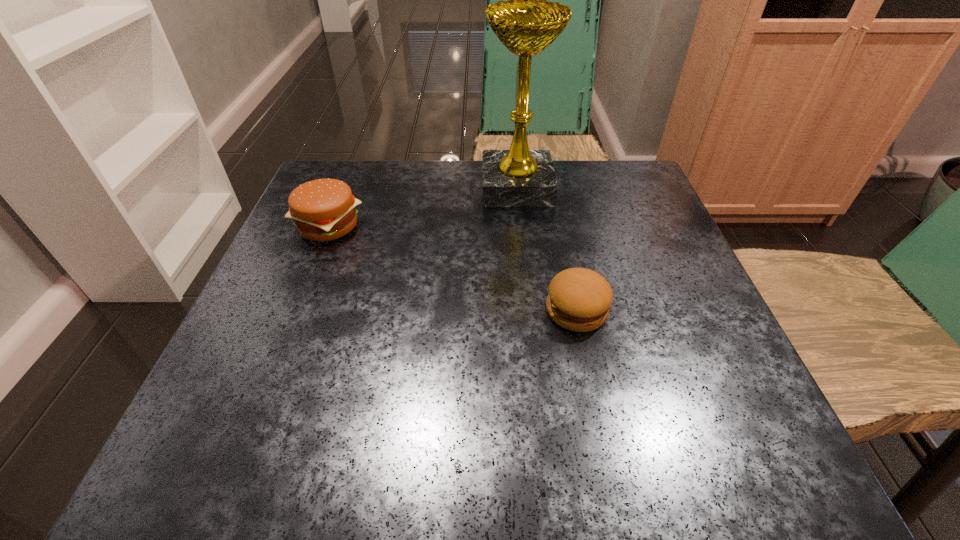
The height and width of the screenshot is (540, 960). Identify the location of the tallest object. (518, 177).

Locate an element on the screen. This screenshot has width=960, height=540. the leftmost object is located at coordinates (323, 209).

This screenshot has width=960, height=540. I want to click on the second tallest object, so click(x=323, y=209).

Identify the location of the nearer hamburger. The image size is (960, 540). (579, 299).

You are a GUI agent. You are given a task and a screenshot of the screen. Output one action in this format:
    pyautogui.click(x=<x>, y=<y>)
    Task: Click on the shorter hamburger
    
    Given the screenshot: What is the action you would take?
    pyautogui.click(x=579, y=299)

Find the location of a particular element. Image resolution: width=960 pixels, height=540 pixels. vacant space located on the front-facing side of the tallest object is located at coordinates [x=342, y=187].

What are the coordinates of `free region located 0.320m on the front-facing side of the tallest object` in the screenshot? It's located at (342, 187).

Identify the location of free point located on the front-facing side of the tallest object. (451, 187).

Where is `vacant space located 0.230m on the right of the second tallest object`? vacant space located 0.230m on the right of the second tallest object is located at coordinates (476, 226).

The width and height of the screenshot is (960, 540). I want to click on vacant position located on the back of the shortest object, so click(x=555, y=208).